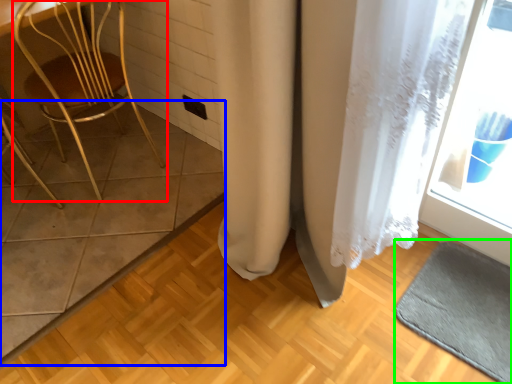
Question: Based on their relative distances, which object is nearer to chair (highlighted by a red box)? Choose from tile (highlighted by a blue box) and bath mat (highlighted by a green box).

Choices:
 (A) tile
 (B) bath mat

Answer: (A)